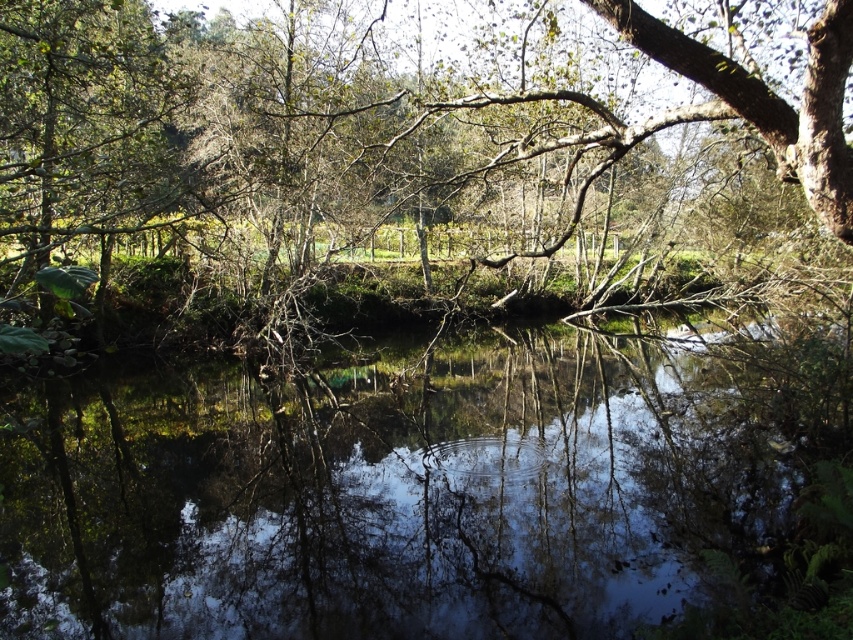
Measure the distance between transparent water at center and green leafy tree at upper center.

transparent water at center and green leafy tree at upper center are 5.35 meters apart from each other.

Does transparent water at center appear over green leafy tree at upper center?

No.

Is point (641, 488) closer to camera compared to point (28, 276)?

Yes, point (641, 488) is closer to viewer.

Image resolution: width=853 pixels, height=640 pixels. I want to click on transparent water at center, so [387, 493].